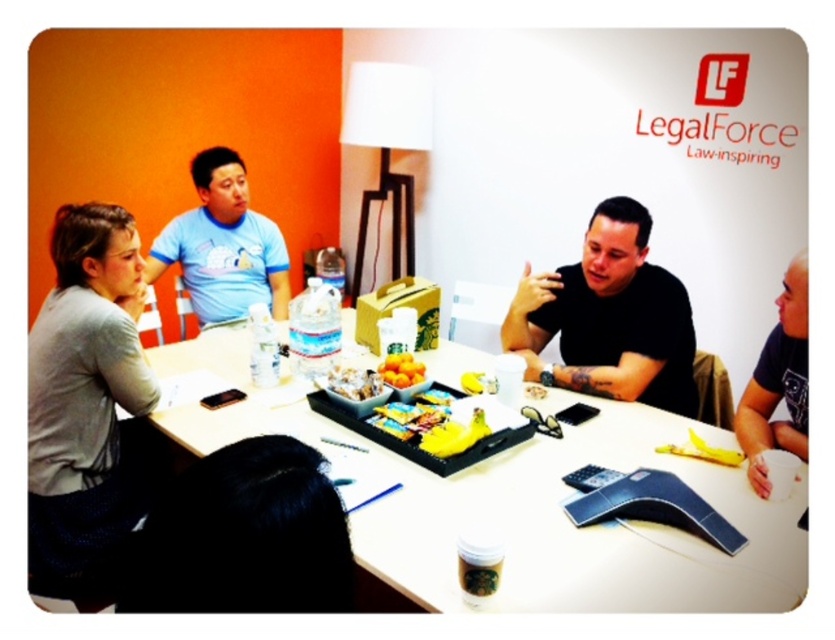
What do you see at coordinates (610, 317) in the screenshot? I see `black matte shirt at center` at bounding box center [610, 317].

Which is below, black matte shirt at center or dark blue t-shirt at right?

dark blue t-shirt at right is below.

Is point (659, 392) positioned after point (801, 278)?

Yes, point (659, 392) is farther from viewer.

The height and width of the screenshot is (640, 835). Identify the location of black matte shirt at center. (610, 317).

Is white glossy table at center smaller than yellow matte oranges at center?

No.

Image resolution: width=835 pixels, height=640 pixels. I want to click on white glossy table at center, so click(x=522, y=504).

Does black matte shirt at center have a greater width compared to light blue t-shirt at upper left?

Yes.

Who is more forward, (610, 397) or (279, 237)?

Point (610, 397) is more forward.

Measure the distance between black matte shirt at center and camera.

They are 6.39 feet apart.

Where is `black matte shirt at center`? This screenshot has width=835, height=640. black matte shirt at center is located at coordinates (610, 317).